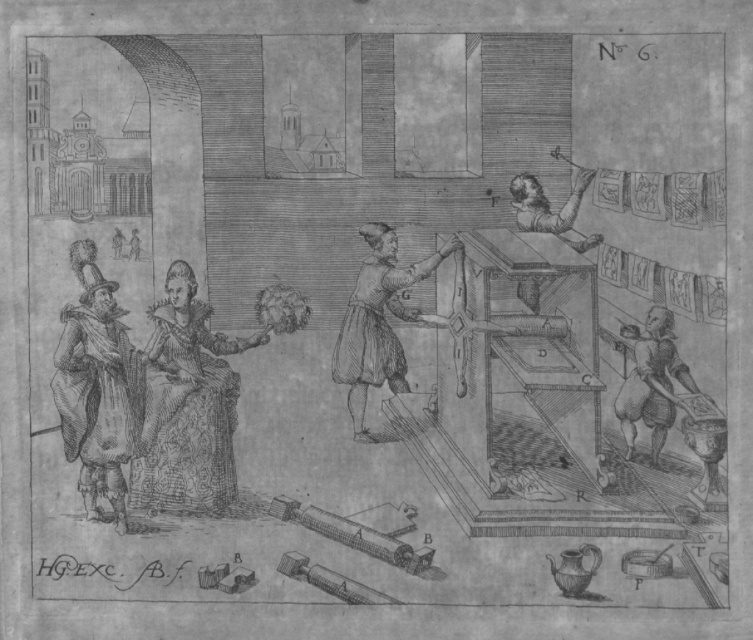
Who is higher up, smooth fabric dress at center or brown paper hat at center?

brown paper hat at center is above.

In order to click on smooth fabric dress at center in this screenshot , I will do `click(187, 404)`.

Where is `smooth fabric dress at center`? This screenshot has height=640, width=753. smooth fabric dress at center is located at coordinates (187, 404).

Image resolution: width=753 pixels, height=640 pixels. I want to click on smooth fabric dress at center, so (x=187, y=404).

Can you confirm if smooth fabric dress at center is positioned above smooth gray hat at left?

Indeed, smooth fabric dress at center is positioned over smooth gray hat at left.

Where is `smooth fabric dress at center`? This screenshot has height=640, width=753. smooth fabric dress at center is located at coordinates (187, 404).

Image resolution: width=753 pixels, height=640 pixels. In order to click on smooth fabric dress at center in this screenshot , I will do `click(187, 404)`.

The width and height of the screenshot is (753, 640). Find the location of `smooth fabric dress at center`. smooth fabric dress at center is located at coordinates (187, 404).

Who is shorter, smooth gray hat at left or brown paper hat at center?

brown paper hat at center

Does point (90, 285) lie in front of point (383, 317)?

Yes.

At what (x,y) coordinates should I click in order to perform the action: click on smooth gray hat at left. Please return your answer as a coordinate pair (x, y). The width and height of the screenshot is (753, 640). Looking at the image, I should click on (98, 392).